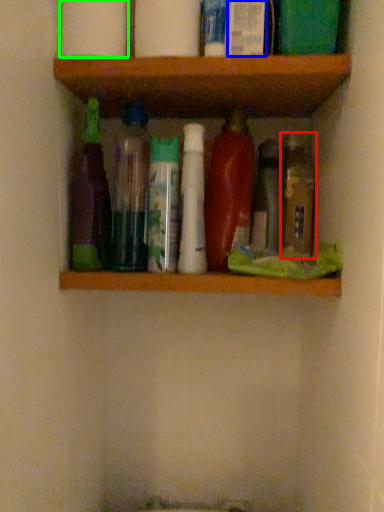
Question: Which is farther away from bottle (highlighted by a red box)? toiletry (highlighted by a blue box) or toilet paper (highlighted by a green box)?

Choices:
 (A) toiletry
 (B) toilet paper

Answer: (B)